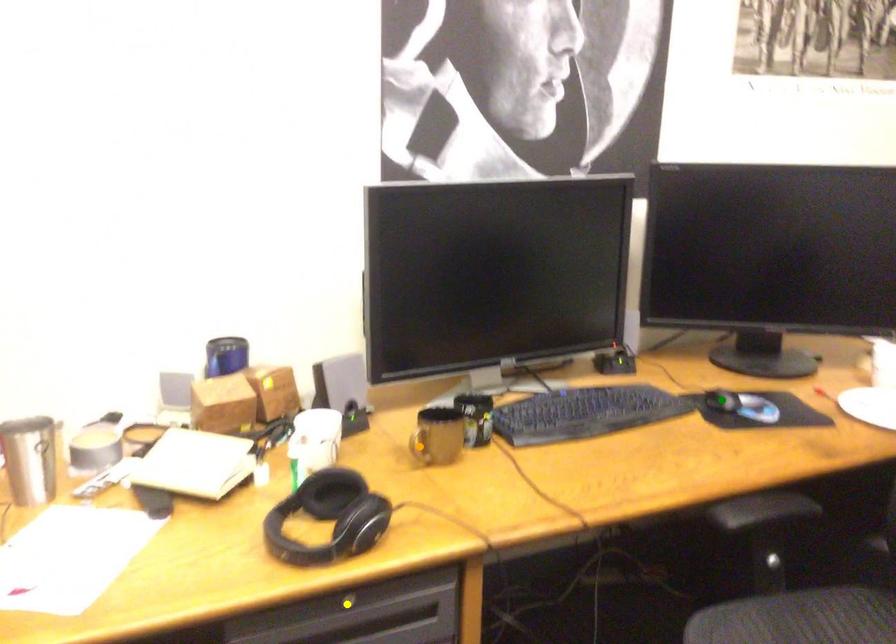
Order these from farthest to nearest:
orange point | green point | yellow point

1. green point
2. orange point
3. yellow point